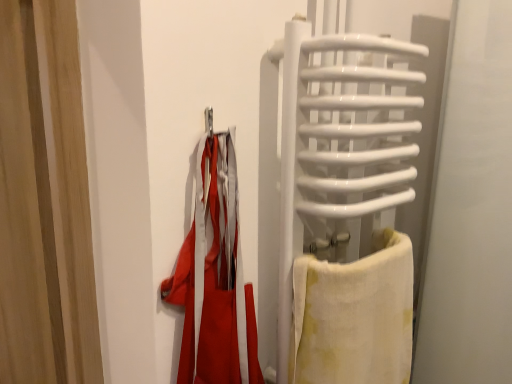
Identify the location of wooden curtain at left. (44, 201).

Describe the element at coordinates (44, 201) in the screenshot. The image size is (512, 384). I see `wooden curtain at left` at that location.

This screenshot has height=384, width=512. Identify the location of white cotton towel at right. (354, 316).

Based on the photo, from the image's perspective, who appears lower, white glossy towel rack at right or wooden curtain at left?

From the image's view, wooden curtain at left is below.

Is white glossy towel rack at right oriented towards wooden curtain at left?

No.

From the picture: How far apart are white glossy towel rack at right and wooden curtain at left?

The distance of white glossy towel rack at right from wooden curtain at left is 18.41 inches.

From a real-world perspective, is white glossy towel rack at right positioned above or below wooden curtain at left?

From a real-world perspective, white glossy towel rack at right is physically above wooden curtain at left.

Considering the points (397, 345) and (60, 190), which point is behind, point (397, 345) or point (60, 190)?

The point (397, 345) is behind.

Is white cotton towel at right at the left side of wooden curtain at left?

No, white cotton towel at right is not to the left of wooden curtain at left.

Is white cotton towel at right positioned far away from wooden curtain at left?

They are positioned close to each other.

Is the position of white cotton towel at right less distant than that of wooden curtain at left?

Yes, white cotton towel at right is in front of wooden curtain at left.

Which object is wider, white glossy towel rack at right or white cotton towel at right?

white glossy towel rack at right is wider.

Choose the correct answer: Is white glossy towel rack at right inside white cotton towel at right or outside it?

The correct answer is: inside.

Considering the relative sizes of white glossy towel rack at right and white cotton towel at right in the image provided, is white glossy towel rack at right smaller than white cotton towel at right?

Actually, white glossy towel rack at right might be larger than white cotton towel at right.

Considering the positions of points (55, 352) and (389, 158), is point (55, 352) farther from camera compared to point (389, 158)?

Yes, it is behind point (389, 158).

Is wooden curtain at left oriented away from white glossy towel rack at right?

wooden curtain at left does not have its back to white glossy towel rack at right.

The image size is (512, 384). I want to click on screen door that is on the right side of wooden curtain at left, so click(339, 138).

Which object is further away from the camera, wooden curtain at left or white cotton towel at right?

wooden curtain at left is behind.

What's the angular difference between wooden curtain at left and white cotton towel at right's facing directions?

The angle between the facing direction of wooden curtain at left and the facing direction of white cotton towel at right is 83.3 degrees.

From a real-world perspective, is wooden curtain at left below white cotton towel at right?

No, from a real-world perspective, wooden curtain at left is not below white cotton towel at right.

Which object is closer to the camera taking this photo, white cotton towel at right or white glossy towel rack at right?

Positioned in front is white glossy towel rack at right.

Considering the sizes of objects white cotton towel at right and white glossy towel rack at right in the image provided, who is thinner, white cotton towel at right or white glossy towel rack at right?

white cotton towel at right.

Based on the photo, from a real-world perspective, is white cotton towel at right over white glossy towel rack at right?

No, from a real-world perspective, white cotton towel at right is not over white glossy towel rack at right

In the scene shown: Would you say white cotton towel at right is outside white glossy towel rack at right?

No, white cotton towel at right is not entirely external to white glossy towel rack at right.

Image resolution: width=512 pixels, height=384 pixels. I want to click on screen door that appears above the wooden curtain at left (from a real-world perspective), so click(x=339, y=138).

Where is `towel in front of the wooden curtain at left`? This screenshot has height=384, width=512. towel in front of the wooden curtain at left is located at coordinates (354, 316).

From the image, which object appears to be farther from white glossy towel rack at right, white cotton towel at right or wooden curtain at left?

Among the two, wooden curtain at left is located further to white glossy towel rack at right.

From the image, which object appears to be farther from wooden curtain at left, white glossy towel rack at right or white cotton towel at right?

white cotton towel at right is further to wooden curtain at left.

When comparing their distances from wooden curtain at left, does white cotton towel at right or white glossy towel rack at right seem further?

The object further to wooden curtain at left is white cotton towel at right.

Based on the photo, which object lies further to the anchor point white cotton towel at right, white glossy towel rack at right or wooden curtain at left?

Among the two, wooden curtain at left is located further to white cotton towel at right.

Which object lies further to the anchor point white cotton towel at right, wooden curtain at left or white glossy towel rack at right?

wooden curtain at left.

Looking at the image, which one is located closer to white glossy towel rack at right, wooden curtain at left or white cotton towel at right?

Among the two, white cotton towel at right is located nearer to white glossy towel rack at right.

The image size is (512, 384). Identify the location of screen door between wooden curtain at left and white cotton towel at right. (339, 138).